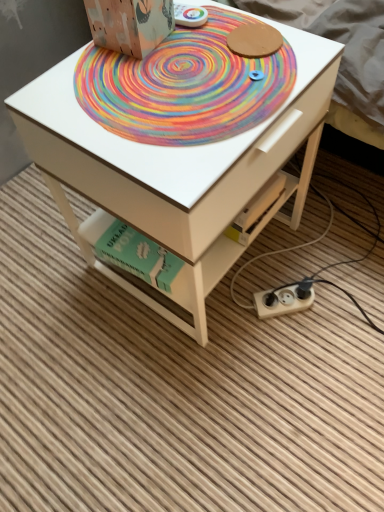
Question: From a real-world perspective, is white plastic plug at lower right above or below wooden cardboard box at upper center?

Choices:
 (A) below
 (B) above

Answer: (A)

Question: In terms of size, does white plastic plug at lower right appear bigger or smaller than wooden cardboard box at upper center?

Choices:
 (A) big
 (B) small

Answer: (B)

Question: Which object is the farthest from the rainbow painted mat at center?

Choices:
 (A) white matte table at center
 (B) white plastic plug at lower right
 (C) wooden cardboard box at upper center
 (D) green cardboard book at lower center

Answer: (B)

Question: Based on their relative distances, which object is nearer to the wooden cardboard box at upper center?

Choices:
 (A) rainbow painted mat at center
 (B) white matte table at center
 (C) green cardboard book at lower center
 (D) white plastic plug at lower right

Answer: (A)